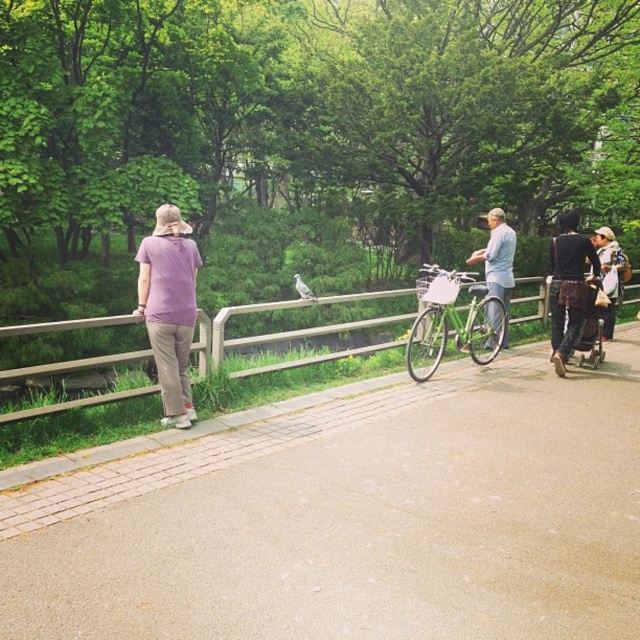
Looking at this image, you are a photographer trying to capture a photo of the wooden fence at left and the dark brown leather jacket at right. Since you want both objects to appear clearly in the frame, which object should you focus on to ensure sharpness?

You should focus on the wooden fence at left because it has a larger size compared to the dark brown leather jacket at right, making it more prominent in the frame and easier to capture clearly.

You are a delivery robot with a 2 meter wide package. You need to navigate through the park scene shown. The concrete pavement at center and the light blue fabric shirt at center are in your path. Can you safely pass between them without hitting the package?

The concrete pavement at center is 4.33 meters away from the light blue fabric shirt at center. Since the package is 2 meters wide, there is sufficient space between them to pass safely.

You are standing at the park and see the concrete pavement at center and the green matte bicycle at center. Which object is closer to the ground?

The concrete pavement at center is closer to the ground because it is located below the green matte bicycle at center.